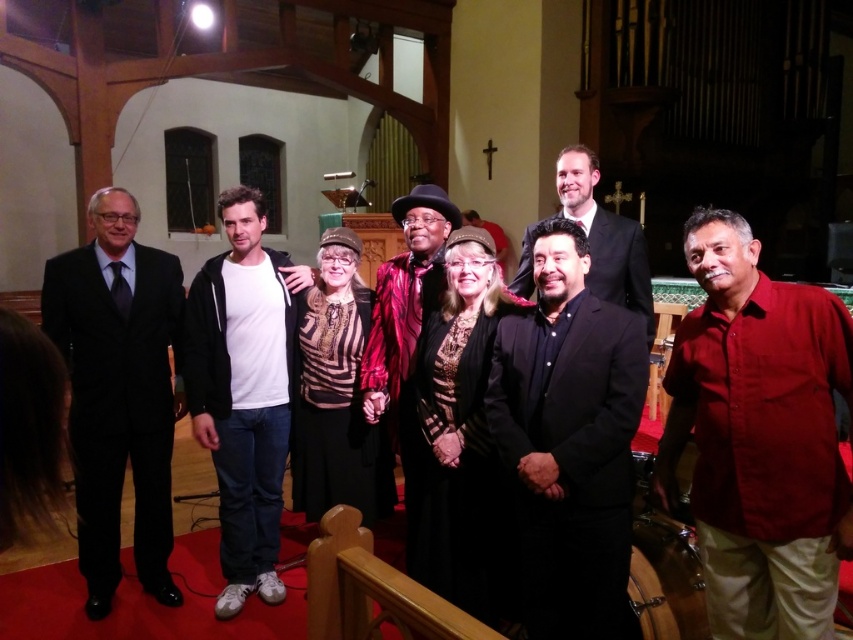
Is black satin suit at center smaller than shiny red jacket at center?

Indeed, black satin suit at center has a smaller size compared to shiny red jacket at center.

Between black satin suit at center and shiny red jacket at center, which one has less height?

With less height is black satin suit at center.

Is point (572, 572) positioned before point (401, 461)?

Yes, point (572, 572) is closer to viewer.

Where is `black satin suit at center`? The image size is (853, 640). black satin suit at center is located at coordinates (567, 440).

Is matte black suit at left wider than shiny red jacket at center?

Correct, the width of matte black suit at left exceeds that of shiny red jacket at center.

Between matte black suit at left and shiny red jacket at center, which one has less height?

With less height is shiny red jacket at center.

Image resolution: width=853 pixels, height=640 pixels. What do you see at coordinates (119, 392) in the screenshot? I see `matte black suit at left` at bounding box center [119, 392].

I want to click on matte black suit at left, so click(x=119, y=392).

Looking at this image, is matte red shirt at right taller than white cotton hoodie at center?

Incorrect, matte red shirt at right's height is not larger of white cotton hoodie at center's.

Who is shorter, matte red shirt at right or white cotton hoodie at center?

With less height is matte red shirt at right.

Find the location of `matte red shirt at right`. matte red shirt at right is located at coordinates (759, 436).